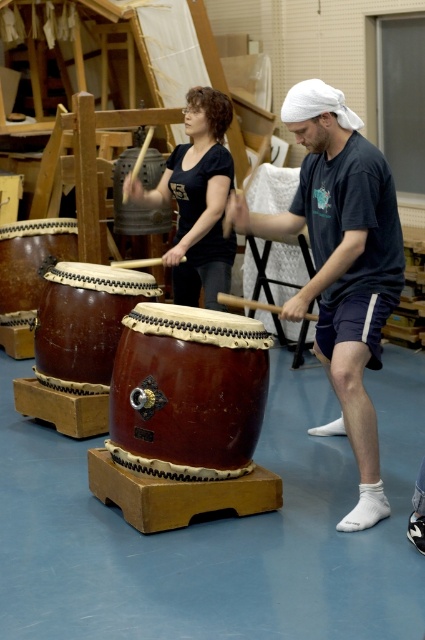
Question: Is shiny brown drum at center positioned before matte black drum at center?

Choices:
 (A) no
 (B) yes

Answer: (B)

Question: Does matte dark brown drum at center have a greater width compared to brown leather drum at center?

Choices:
 (A) yes
 (B) no

Answer: (A)

Question: Can you confirm if matte black drum at center is smaller than brown wooden drum at center?

Choices:
 (A) yes
 (B) no

Answer: (B)

Question: Which point is farther from the camera taking this photo?

Choices:
 (A) coord(340,266)
 (B) coord(201,250)
 (C) coord(149,292)
 (D) coord(42,250)

Answer: (D)

Question: Which of these objects is positioned closest to the brown wooden drum at center?

Choices:
 (A) matte black drum at center
 (B) brown leather drum at left

Answer: (B)

Question: Which point is closer to the camera?

Choices:
 (A) shiny brown drum at center
 (B) brown wooden drum at center
 (C) brown leather drum at left
 (D) brown leather drum at center

Answer: (A)